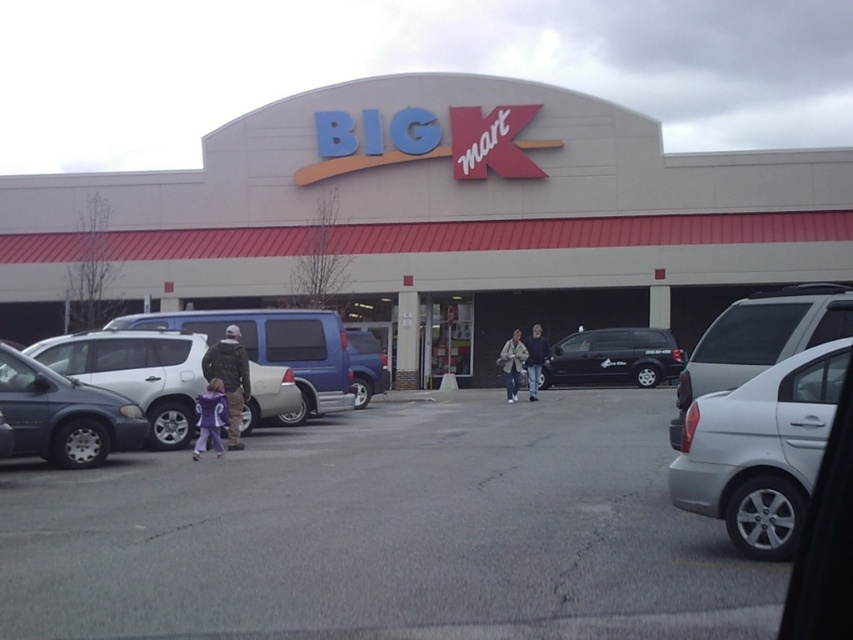
You are a delivery driver who needs to park your truck, which is 6 meters long, in the parking lot. You see the white matte sedan at right and the black matte minivan at center. Can you estimate if there is enough space between these two vehicles to park your truck?

The white matte sedan at right has a larger size compared to black matte minivan at center. However, without knowing the exact distance between them, it is impossible to determine if there is enough space for a 6 meter truck. Please check the actual distance between the two vehicles.

In the scene shown: You are standing in front of the Big Kmart store and want to take a photo of both the point at coordinates point [64,390] and point [610,358]. Which point should you focus on first to ensure both are in focus?

You should focus on point [64,390] first because it is closer to the camera than point [610,358], ensuring both points are within the depth of field.

You are a delivery person standing in front of the Big Kmart store and need to park your vehicle. You see a white matte sedan at right and a black matte minivan at center. Which vehicle is parked closer to the entrance of the store?

The white matte sedan at right is closer to the viewer than the black matte minvan at center, so the white matte sedan at right is parked closer to the entrance of the store.